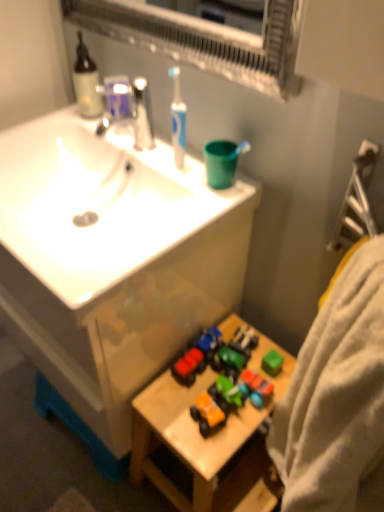
Find the location of a particular element. The width and height of the screenshot is (384, 512). vacant space behind matte silver faucet at upper center is located at coordinates (125, 130).